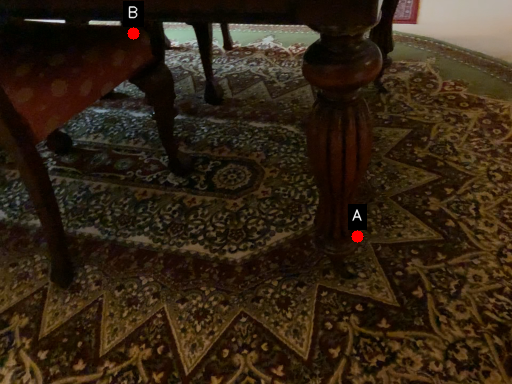
Question: Two points are circled on the image, labeled by A and B beside each circle. Which point is further to the camera?

Choices:
 (A) A is further
 (B) B is further

Answer: (A)